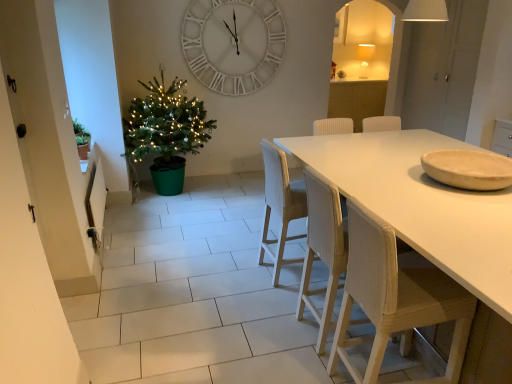
What do you see at coordinates (395, 299) in the screenshot? I see `wooden textured chair at right, acting as the 3th chair starting from the back` at bounding box center [395, 299].

The height and width of the screenshot is (384, 512). Describe the element at coordinates (323, 249) in the screenshot. I see `white woven chair at center, arranged as the 2th chair when viewed from the back` at that location.

This screenshot has height=384, width=512. Describe the element at coordinates (82, 140) in the screenshot. I see `green matte plant at left` at that location.

Identify the location of woven wood chair at center, which is counted as the 3th chair, starting from the front. Image resolution: width=512 pixels, height=384 pixels. (280, 204).

What do you see at coordinates (233, 43) in the screenshot? I see `white wooden clock at upper center` at bounding box center [233, 43].

Where is `wooden bowl at right`? This screenshot has width=512, height=384. wooden bowl at right is located at coordinates (468, 169).

In order to click on green matte christmas tree at left in this screenshot , I will do `click(166, 132)`.

Considering the relative positions of wooden bowl at right and white wooden clock at upper center in the image provided, is wooden bowl at right to the left of white wooden clock at upper center from the viewer's perspective?

Incorrect, wooden bowl at right is not on the left side of white wooden clock at upper center.

How distant is wooden bowl at right from white wooden clock at upper center?

10.22 feet.

Looking at this image, is wooden bowl at right closer to camera compared to white wooden clock at upper center?

Yes, the depth of wooden bowl at right is less than that of white wooden clock at upper center.

Between wooden bowl at right and white wooden clock at upper center, which one has more height?

white wooden clock at upper center is taller.

Identify the location of bowl on the right of the white woven chair at center, which is the second chair in front-to-back order. (468, 169).

In the scene shown: Is wooden bowl at right positioned beyond the bounds of white woven chair at center, arranged as the 2th chair when viewed from the back?

Yes, wooden bowl at right is not within white woven chair at center, arranged as the 2th chair when viewed from the back.

In the scene shown: From a real-world perspective, who is located higher, wooden bowl at right or white woven chair at center, arranged as the 2th chair when viewed from the back?

wooden bowl at right is physically above.

Can you confirm if wooden bowl at right is smaller than white woven chair at center, arranged as the 2th chair when viewed from the back?

Yes.

Is woven wood chair at center, which is counted as the 3th chair, starting from the front, inside or outside of wooden textured chair at right, the first chair from the front?

The correct answer is: outside.

Between woven wood chair at center, which is counted as the 3th chair, starting from the front, and wooden textured chair at right, the first chair from the front, which one appears on the left side from the viewer's perspective?

woven wood chair at center, which is counted as the 3th chair, starting from the front.

Does woven wood chair at center, which is counted as the 3th chair, starting from the front, have a larger size compared to wooden textured chair at right, the first chair from the front?

Indeed, woven wood chair at center, which is counted as the 3th chair, starting from the front, has a larger size compared to wooden textured chair at right, the first chair from the front.

The height and width of the screenshot is (384, 512). I want to click on the 2nd chair below the woven wood chair at center, the 1th chair in the back-to-front sequence (from the image's perspective), so click(x=395, y=299).

From the image's perspective, would you say green matte plant at left is shown under wooden textured chair at right, acting as the 3th chair starting from the back?

Actually, green matte plant at left appears above wooden textured chair at right, acting as the 3th chair starting from the back, in the image.

Considering the relative sizes of green matte plant at left and wooden textured chair at right, the first chair from the front, in the image provided, is green matte plant at left thinner than wooden textured chair at right, the first chair from the front,?

Correct, the width of green matte plant at left is less than that of wooden textured chair at right, the first chair from the front.

Is wooden textured chair at right, the first chair from the front, surrounded by green matte plant at left?

No, wooden textured chair at right, the first chair from the front, is not inside green matte plant at left.

Would you say green matte plant at left is a long distance from wooden textured chair at right, the first chair from the front?

Yes.

Where is `christmas tree on the left of white matte table at center`? christmas tree on the left of white matte table at center is located at coordinates (166, 132).

Consider the image. From the image's perspective, is white matte table at center below green matte christmas tree at left?

Correct, white matte table at center appears lower than green matte christmas tree at left in the image.

Do you think white matte table at center is within green matte christmas tree at left, or outside of it?

white matte table at center is spatially situated outside green matte christmas tree at left.

Which point is more distant from viewer, (x=466, y=382) or (x=210, y=120)?

Positioned behind is point (x=210, y=120).

Is white wooden clock at upper center inside the boundaries of woven wood chair at center, which is counted as the 3th chair, starting from the front, or outside?

white wooden clock at upper center is not enclosed by woven wood chair at center, which is counted as the 3th chair, starting from the front.

Considering the sizes of objects white wooden clock at upper center and woven wood chair at center, which is counted as the 3th chair, starting from the front, in the image provided, who is taller, white wooden clock at upper center or woven wood chair at center, which is counted as the 3th chair, starting from the front,?

Standing taller between the two is white wooden clock at upper center.

From the picture: Considering their positions, is white wooden clock at upper center located in front of or behind woven wood chair at center, which is counted as the 3th chair, starting from the front?

white wooden clock at upper center is behind woven wood chair at center, which is counted as the 3th chair, starting from the front.

Between white wooden clock at upper center and woven wood chair at center, which is counted as the 3th chair, starting from the front, which one has smaller width?

white wooden clock at upper center is thinner.

Is wooden bowl at right in front of woven wood chair at center, the 1th chair in the back-to-front sequence?

A: Yes, wooden bowl at right is in front of woven wood chair at center, the 1th chair in the back-to-front sequence.

From the image's perspective, which is below, wooden bowl at right or woven wood chair at center, the 1th chair in the back-to-front sequence?

woven wood chair at center, the 1th chair in the back-to-front sequence, appears lower in the image.

How many degrees apart are the facing directions of wooden bowl at right and woven wood chair at center, the 1th chair in the back-to-front sequence?

wooden bowl at right and woven wood chair at center, the 1th chair in the back-to-front sequence, are facing 179 degrees away from each other.

The image size is (512, 384). Find the location of `wall clock that appears above the wooden bowl at right (from the image's perspective)`. wall clock that appears above the wooden bowl at right (from the image's perspective) is located at coordinates (233, 43).

Where is `chair that is the 2nd one when counting leftward from the wooden bowl at right`? The image size is (512, 384). chair that is the 2nd one when counting leftward from the wooden bowl at right is located at coordinates (323, 249).

Estimate the real-world distances between objects in this image. Which object is further from white matte table at center, green matte christmas tree at left or green matte plant at left?

green matte plant at left is further to white matte table at center.

Considering their positions, is green matte plant at left positioned further to wooden bowl at right than white wooden clock at upper center?

white wooden clock at upper center is further to wooden bowl at right.

From the image, which object appears to be farther from wooden bowl at right, green matte christmas tree at left or woven wood chair at center, the 1th chair in the back-to-front sequence?

Based on the image, green matte christmas tree at left appears to be further to wooden bowl at right.

Looking at the image, which one is located closer to white matte table at center, wooden bowl at right or woven wood chair at center, the 1th chair in the back-to-front sequence?

Based on the image, wooden bowl at right appears to be nearer to white matte table at center.

When comparing their distances from white wooden clock at upper center, does green matte plant at left or white woven chair at center, which is the second chair in front-to-back order, seem closer?

Based on the image, green matte plant at left appears to be nearer to white wooden clock at upper center.

Consider the image. When comparing their distances from white matte table at center, does woven wood chair at center, the 1th chair in the back-to-front sequence, or green matte christmas tree at left seem closer?

woven wood chair at center, the 1th chair in the back-to-front sequence, is positioned closer to the anchor white matte table at center.

Looking at the image, which one is located further to green matte christmas tree at left, wooden bowl at right or white matte table at center?

wooden bowl at right is further to green matte christmas tree at left.

Looking at the image, which one is located further to green matte plant at left, white wooden clock at upper center or white woven chair at center, arranged as the 2th chair when viewed from the back?

The object further to green matte plant at left is white woven chair at center, arranged as the 2th chair when viewed from the back.

Identify the location of christmas tree located between green matte plant at left and white woven chair at center, arranged as the 2th chair when viewed from the back, in the left-right direction. (166, 132).

The image size is (512, 384). I want to click on houseplant located between wooden textured chair at right, the first chair from the front, and white wooden clock at upper center in the depth direction, so (82, 140).

You are a GUI agent. You are given a task and a screenshot of the screen. Output one action in this format:
    pyautogui.click(x=<x>, y=<y>)
    Task: Click on the bowl located between wooden textured chair at right, acting as the 3th chair starting from the back, and green matte christmas tree at left in the depth direction
    Image resolution: width=512 pixels, height=384 pixels.
    Given the screenshot: What is the action you would take?
    pyautogui.click(x=468, y=169)

The width and height of the screenshot is (512, 384). Find the location of `bowl positioned between white matte table at center and woven wood chair at center, the 1th chair in the back-to-front sequence, from near to far`. bowl positioned between white matte table at center and woven wood chair at center, the 1th chair in the back-to-front sequence, from near to far is located at coordinates (468, 169).